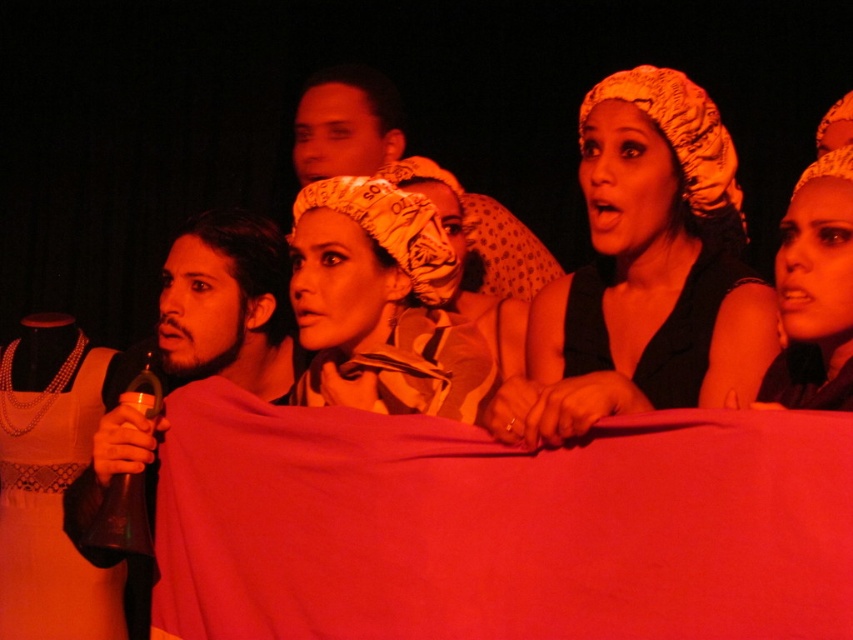
Between matte yellow headscarf at upper right and matte beige headscarf at upper right, which one appears on the left side from the viewer's perspective?

Positioned to the left is matte yellow headscarf at upper right.

Which is behind, point (680, 397) or point (851, 378)?

Point (680, 397)

In order to click on matte yellow headscarf at upper right in this screenshot , I will do `click(645, 273)`.

Does matte yellow headscarf at upper right appear over white lace dress at left?

Correct, matte yellow headscarf at upper right is located above white lace dress at left.

Between point (647, 131) and point (64, 410), which one is positioned in front?

Point (647, 131) is more forward.

Identify the location of matte yellow headscarf at upper right. Image resolution: width=853 pixels, height=640 pixels. (645, 273).

Identify the location of matte yellow headscarf at upper right. (645, 273).

Who is positioned more to the left, silky red fabric at center or white lace dress at left?

white lace dress at left is more to the left.

Does silky red fabric at center have a larger size compared to white lace dress at left?

No.

Between point (637, 621) and point (15, 483), which one is positioned behind?

Positioned behind is point (15, 483).

Identify the location of silky red fabric at center. The height and width of the screenshot is (640, 853). (498, 525).